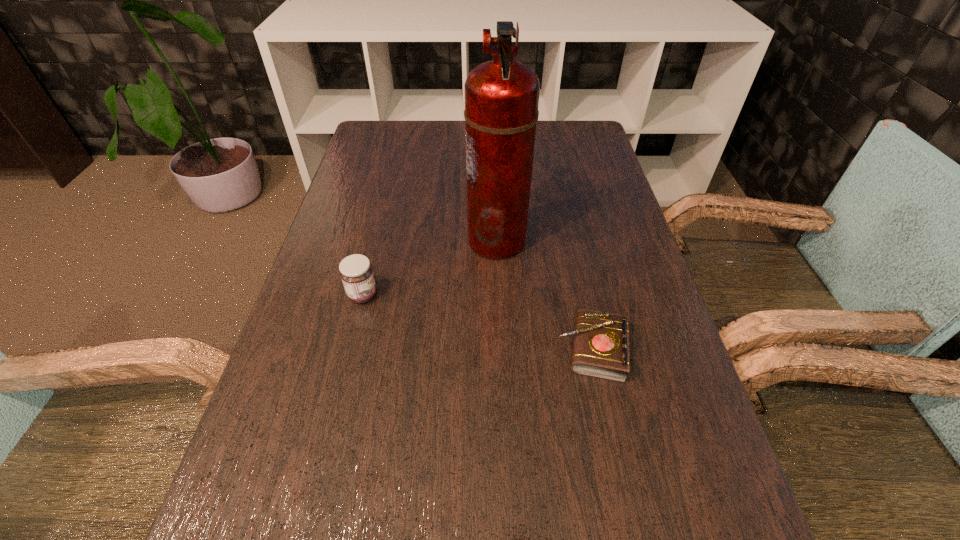
Locate an element on the screen. The height and width of the screenshot is (540, 960). empty location between the jam and the tallest object is located at coordinates click(430, 267).

Where is `free spot between the jam and the farthest object`? The height and width of the screenshot is (540, 960). free spot between the jam and the farthest object is located at coordinates (430, 267).

The image size is (960, 540). In order to click on unoccupied area between the jam and the diary in this screenshot , I will do `click(477, 322)`.

Find the location of a particular element. This screenshot has height=540, width=960. object that ranks as the second closest to the diary is located at coordinates (356, 272).

The image size is (960, 540). In order to click on object identified as the second closest to the tallest object in this screenshot , I will do `click(356, 272)`.

Find the location of a particular element. The image size is (960, 540). vacant space that satisfies the following two spatial constraints: 1. on the front label of the second tallest object; 2. on the left side of the nearest object is located at coordinates (349, 349).

Find the location of `vacant region that satisfies the following two spatial constraints: 1. on the front label of the leftmost object; 2. on the left side of the nearest object`. vacant region that satisfies the following two spatial constraints: 1. on the front label of the leftmost object; 2. on the left side of the nearest object is located at coordinates (349, 349).

The height and width of the screenshot is (540, 960). In order to click on free space that satisfies the following two spatial constraints: 1. on the side of the farthest object with the handle and hose; 2. on the left side of the nearest object in this screenshot , I will do `click(501, 349)`.

This screenshot has height=540, width=960. Find the location of `free space that satisfies the following two spatial constraints: 1. on the back side of the nearest object; 2. on the front label of the jam`. free space that satisfies the following two spatial constraints: 1. on the back side of the nearest object; 2. on the front label of the jam is located at coordinates (581, 295).

This screenshot has width=960, height=540. What are the coordinates of `blank space that satisfies the following two spatial constraints: 1. on the side of the fire extinguisher with the handle and hose; 2. on the right side of the diary` in the screenshot? It's located at (501, 349).